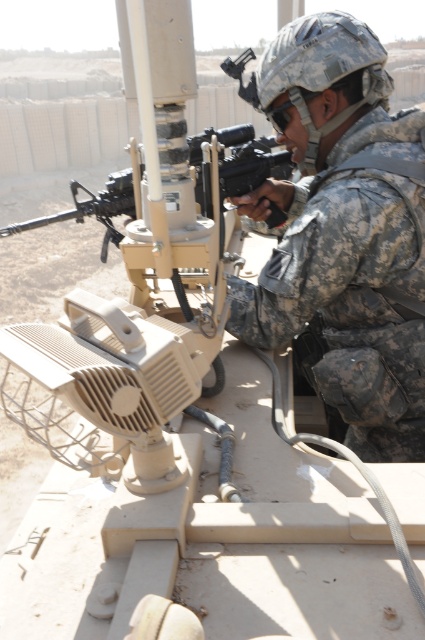
Question: Which object appears closest to the camera in this image?

Choices:
 (A) camouflage fabric helmet at upper right
 (B) matte black rifle at center

Answer: (A)

Question: Is camouflage fabric helmet at upper right in front of matte black rifle at center?

Choices:
 (A) yes
 (B) no

Answer: (A)

Question: From the image, what is the correct spatial relationship of camouflage fabric helmet at upper right in relation to matte black rifle at center?

Choices:
 (A) above
 (B) below

Answer: (A)

Question: In this image, where is camouflage fabric helmet at upper right located relative to matte black rifle at center?

Choices:
 (A) above
 (B) below

Answer: (A)

Question: Which point is farther to the camera?

Choices:
 (A) camouflage fabric helmet at upper right
 (B) matte black rifle at center

Answer: (B)